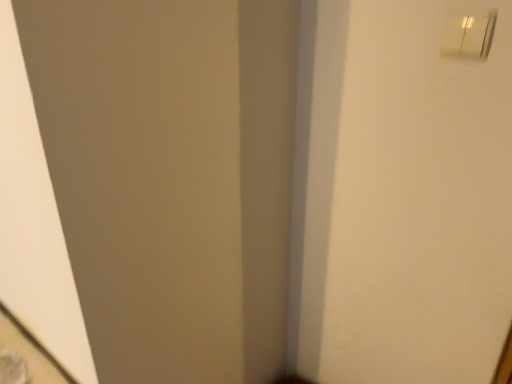
Describe the element at coordinates (469, 36) in the screenshot. I see `white plastic light switch at upper right` at that location.

You are a GUI agent. You are given a task and a screenshot of the screen. Output one action in this format:
    pyautogui.click(x=<x>, y=<y>)
    Task: Click on the white plastic light switch at upper right
    This screenshot has height=384, width=512.
    Given the screenshot: What is the action you would take?
    pyautogui.click(x=469, y=36)

Identify the location of white plastic light switch at upper right. This screenshot has height=384, width=512. (469, 36).